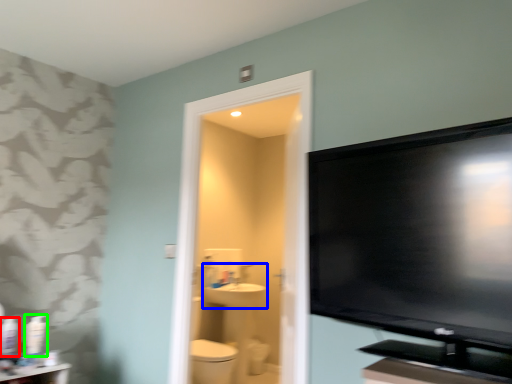
Question: Which object is the closest to the toiletry (highlighted by a red box)? Choose among these: sink (highlighted by a blue box) or toiletry (highlighted by a green box).

Choices:
 (A) sink
 (B) toiletry

Answer: (B)